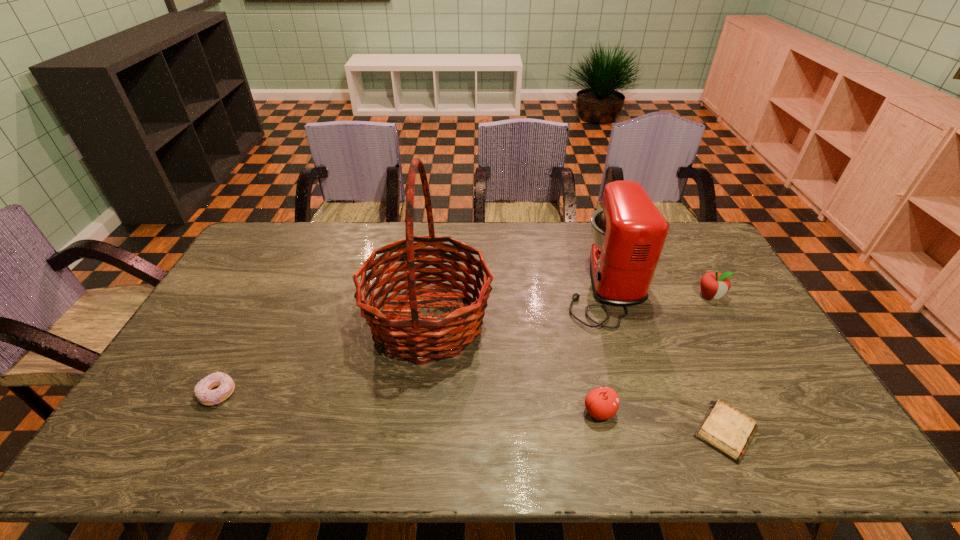
Where is `object located at the left edge`? This screenshot has height=540, width=960. object located at the left edge is located at coordinates (203, 391).

Identify the location of object present at the right edge. (715, 285).

In the image, there is a desktop. At what (x,y) coordinates should I click in order to perform the action: click on vacant space at the far edge. Please return your answer as a coordinate pair (x, y). Looking at the image, I should click on click(x=511, y=242).

The height and width of the screenshot is (540, 960). Identify the location of vacant region at the near edge of the desktop. (217, 456).

Where is `vacant region at the left edge of the desktop`? This screenshot has height=540, width=960. vacant region at the left edge of the desktop is located at coordinates [x=216, y=316].

In the image, there is a desktop. Identify the location of vacant space at the right edge. (764, 357).

Identify the location of vacant space at the near left corner of the desktop. (140, 459).

Where is `blank space at the far right corner of the desktop`? This screenshot has width=960, height=540. blank space at the far right corner of the desktop is located at coordinates 694,239.

Locate an element on the screen. The image size is (960, 540). free region at the near right corner of the desktop is located at coordinates (805, 453).

Identify the location of free area in between the nearer apple and the leftmost object. [x=409, y=403].